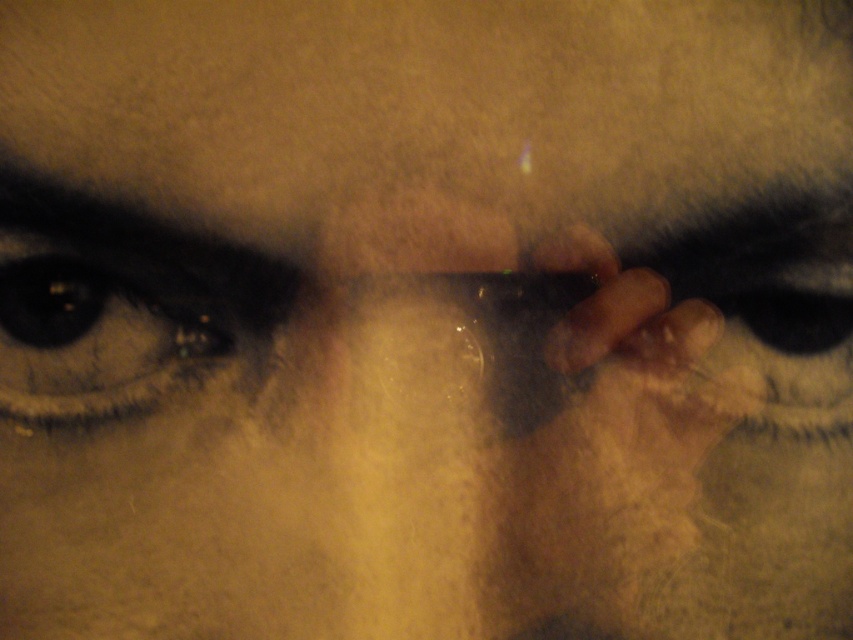
Based on the scene description, where is the smooth skin at center positioned in terms of coordinates?

The smooth skin at center is located at point coordinates of (428, 102).

Based on the scene description, can you determine the spatial relationship between the smooth skin at center and the brown matte eye at left?

The smooth skin at center is located above the brown matte eye at left according to the description.

You are a photographer trying to adjust your camera settings to capture a sharp image of the subject. The camera has a focal length of 50mm and an aperture of f2.8. You want to ensure that the point at coordinate point (242,68) is in focus. Given that the depth of field extends 10 cm in front and behind the focal plane, is the point within the depth of field?

The point at coordinate point (242,68) is 34.21 centimeters from the camera. The depth of field extends 10 cm in front and behind the focal plane, so if the focal plane is set at 34.21 cm, the point will be within the depth of field. However, if the focal plane is not set at that distance, the point may be out of focus. Adjust the focus so that the focal plane aligns with the point to ensure sharpness.